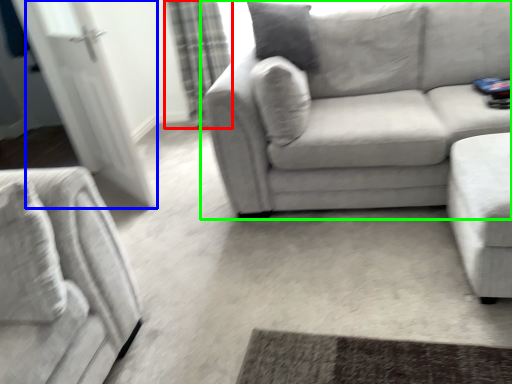
Question: Which object is the farthest from curtain (highlighted by a red box)? Choose among these: glass door (highlighted by a blue box) or studio couch (highlighted by a green box).

Choices:
 (A) glass door
 (B) studio couch

Answer: (B)